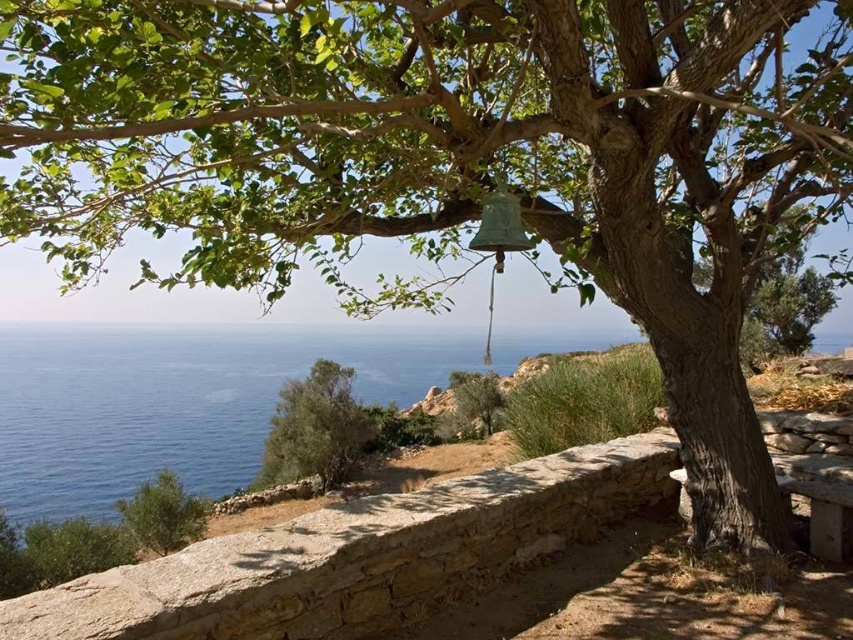
Question: Among these points, which one is farthest from the camera?

Choices:
 (A) (492, 429)
 (B) (793, 276)

Answer: (A)

Question: Does stone wall at center appear under smooth bark tree at center?

Choices:
 (A) no
 (B) yes

Answer: (B)

Question: Which object appears farthest from the camera in this image?

Choices:
 (A) green leafy tree at center
 (B) blue water at lower left
 (C) stone wall at center

Answer: (A)

Question: From the image, what is the correct spatial relationship of smooth bark tree at center in relation to green leafy tree at center?

Choices:
 (A) above
 (B) below

Answer: (A)

Question: Does blue water at lower left have a larger size compared to green leafy tree at center?

Choices:
 (A) yes
 (B) no

Answer: (A)

Question: Considering the real-world distances, which object is closest to the blue water at lower left?

Choices:
 (A) green leafy shrub at lower left
 (B) green leafy tree at center
 (C) stone wall at center

Answer: (A)